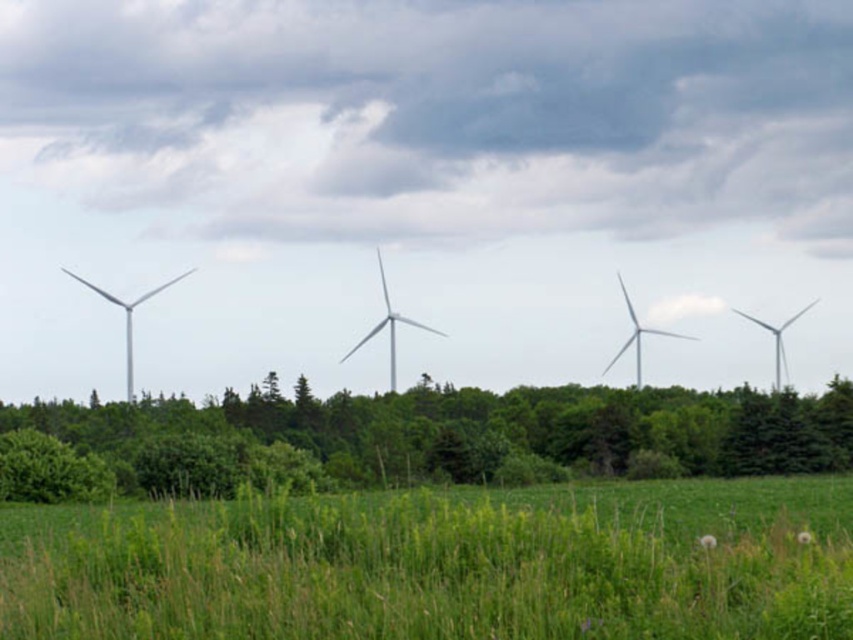
Does green leafy tree at lower center have a greater width compared to white matte wind turbine at center?

Yes.

Can you confirm if green leafy tree at lower center is positioned to the left of white matte wind turbine at center?

Yes, green leafy tree at lower center is to the left of white matte wind turbine at center.

Who is more distant from viewer, (813, 448) or (637, 317)?

Point (637, 317)

Image resolution: width=853 pixels, height=640 pixels. What are the coordinates of `green leafy tree at lower center` in the screenshot? It's located at (485, 428).

Describe the element at coordinates (442, 564) in the screenshot. I see `green grass at lower center` at that location.

Which is in front, point (78, 520) or point (621, 280)?

Point (78, 520) is more forward.

Does point (56, 595) lie behind point (630, 340)?

No, (56, 595) is closer to viewer.

The height and width of the screenshot is (640, 853). Find the location of `green grass at lower center`. green grass at lower center is located at coordinates (442, 564).

Consider the image. Is green leafy tree at lower center below white metallic wind turbine at right?

Correct, green leafy tree at lower center is located below white metallic wind turbine at right.

Does point (146, 403) lie behind point (773, 332)?

No, (146, 403) is in front of (773, 332).

Where is `green leafy tree at lower center`? The image size is (853, 640). green leafy tree at lower center is located at coordinates (485, 428).